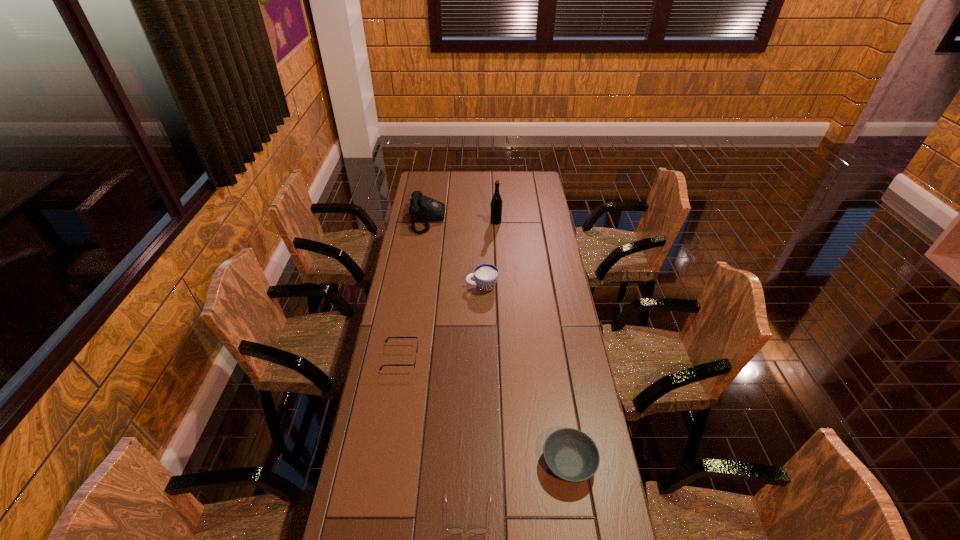
Locate an element on the screen. This screenshot has height=540, width=960. beer bottle is located at coordinates (496, 203).

Find the location of a particular element. The image size is (960, 540). telephone is located at coordinates (424, 209).

At what (x,y) coordinates should I click in order to perform the action: click on the fourth nearest object. Please return your answer as a coordinate pair (x, y). Looking at the image, I should click on (485, 275).

I want to click on cup, so click(x=485, y=275).

This screenshot has height=540, width=960. Find the location of `the fifth farthest object`. the fifth farthest object is located at coordinates (571, 455).

Find the location of `the third shortest object`. the third shortest object is located at coordinates (571, 455).

Locate an element on the screen. This screenshot has height=540, width=960. the nearer spectacles is located at coordinates (452, 530).

You are a GUI agent. You are given a task and a screenshot of the screen. Output one action in this format:
    pyautogui.click(x=<x>, y=<y>)
    Task: Click on the nearest object
    This screenshot has height=540, width=960.
    Given the screenshot: What is the action you would take?
    pyautogui.click(x=452, y=530)

Where is `the fourth farthest object`? the fourth farthest object is located at coordinates (414, 364).

You are a GUI agent. You are given a task and a screenshot of the screen. Output one action in this format:
    pyautogui.click(x=<x>, y=<y>)
    Task: Click on the left spectacles
    Image resolution: width=960 pixels, height=540 pixels.
    Given the screenshot: What is the action you would take?
    [x=414, y=364]